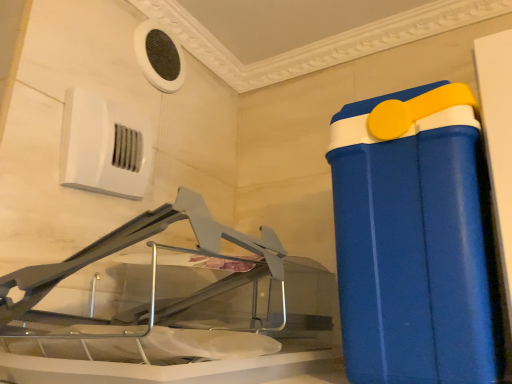
Question: Considering the positions of point (175, 89) and point (442, 236), is point (175, 89) closer or farther from the camera than point (442, 236)?

Choices:
 (A) closer
 (B) farther

Answer: (B)

Question: Considering the positions of white mesh air conditioning at upper left, acting as the 2th air conditioning starting from the bottom, and blue plastic container at right in the image, is white mesh air conditioning at upper left, acting as the 2th air conditioning starting from the bottom, taller or shorter than blue plastic container at right?

Choices:
 (A) tall
 (B) short

Answer: (B)

Question: Which object is the farthest from the blue plastic container at right?

Choices:
 (A) white mesh air conditioning at upper left, the 2th air conditioning when ordered from front to back
 (B) white plastic air conditioning unit at upper left, arranged as the second air conditioning when viewed from the back

Answer: (A)

Question: Which object is positioned closest to the white plastic air conditioning unit at upper left, arranged as the second air conditioning when viewed from the back?

Choices:
 (A) blue plastic container at right
 (B) white mesh air conditioning at upper left, acting as the 2th air conditioning starting from the bottom

Answer: (B)